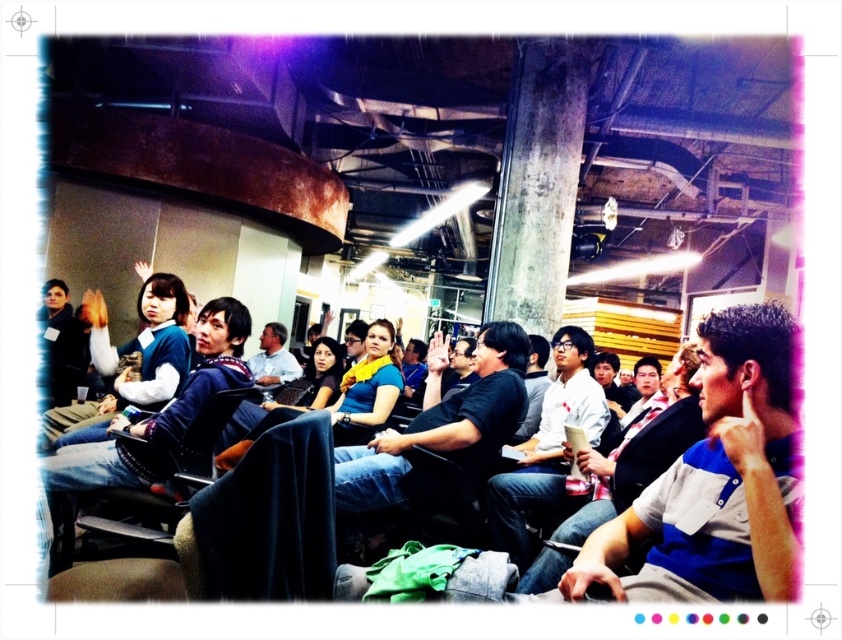
Question: Is white matte shirt at center behind light blue shirt at center?

Choices:
 (A) no
 (B) yes

Answer: (A)

Question: Does concrete at center appear on the left side of matte black sweater at upper left?

Choices:
 (A) yes
 (B) no

Answer: (B)

Question: Which object is closer to the camera taking this photo?

Choices:
 (A) knitted sweater at center
 (B) concrete at center
 (C) white matte shirt at center
 (D) matte black sweater at upper left

Answer: (A)

Question: Based on their relative distances, which object is nearer to the black matte shirt at center?

Choices:
 (A) concrete at center
 (B) knitted sweater at center
 (C) blue shirt at center
 (D) matte black sweater at upper left

Answer: (C)

Question: Estimate the real-world distances between objects in this image. Which object is closer to the light blue shirt at center?

Choices:
 (A) black matte shirt at center
 (B) knitted sweater at center
 (C) blue shirt at center
 (D) white matte shirt at center

Answer: (B)

Question: Is blue shirt at center positioned in front of light blue shirt at center?

Choices:
 (A) no
 (B) yes

Answer: (B)